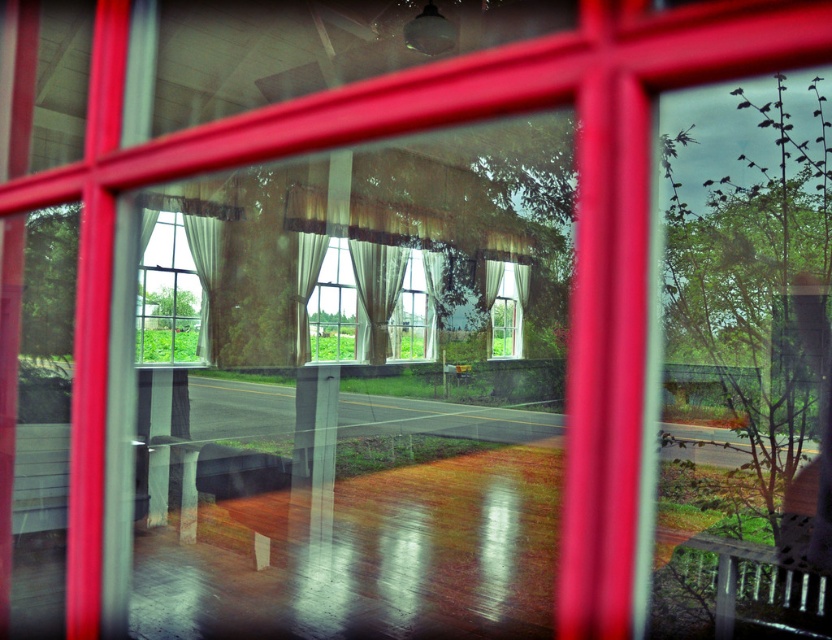
Which is below, matte glass window at center or beige textured curtain at center?

Positioned lower is matte glass window at center.

Between matte glass window at center and beige textured curtain at center, which one has more height?

beige textured curtain at center

The height and width of the screenshot is (640, 832). Find the location of `matte glass window at center`. matte glass window at center is located at coordinates (504, 307).

Is the position of wooden park bench at center more distant than that of matte glass window at center?

No, it is in front of matte glass window at center.

Which of these two, wooden park bench at center or matte glass window at center, stands taller?

matte glass window at center is taller.

Between point (241, 477) and point (504, 291), which one is positioned in front?

Positioned in front is point (241, 477).

The width and height of the screenshot is (832, 640). Identify the location of wooden park bench at center. (239, 472).

Can you confirm if translucent white curtains at center is bigger than white sheer curtain at center?

Indeed, translucent white curtains at center has a larger size compared to white sheer curtain at center.

The width and height of the screenshot is (832, 640). Identify the location of translucent white curtains at center. (167, 296).

Does point (156, 220) come farther from viewer compared to point (201, 344)?

No.

Where is `translucent white curtains at center`? This screenshot has height=640, width=832. translucent white curtains at center is located at coordinates (167, 296).